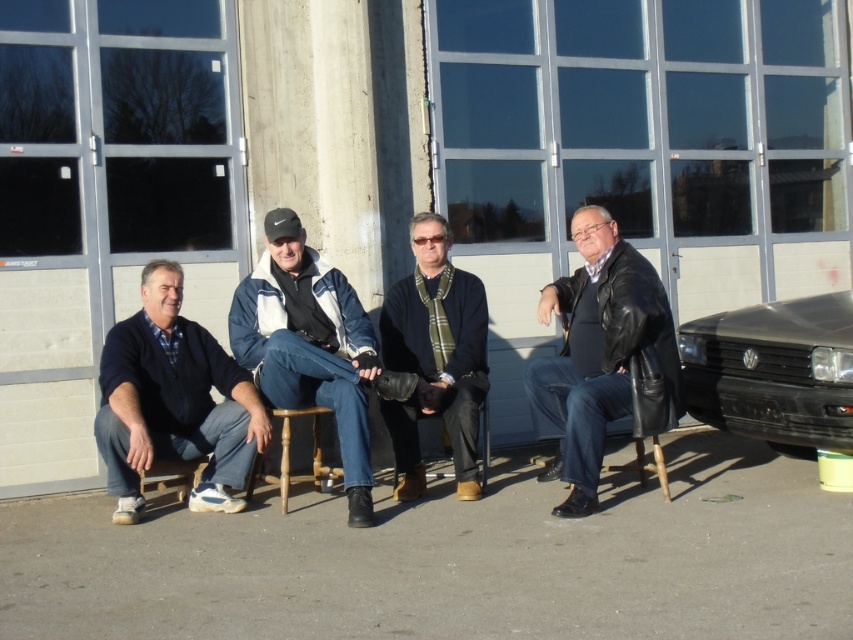
You are a photographer trying to capture a group photo of the men in front of the building. You want to ensure that both the white fleece jacket at center and the dark blue sweater at center are visible in the frame. Based on their positions, which one should you focus on first to ensure they are both in the shot?

Since the white fleece jacket at center is to the left of the dark blue sweater at center, you should focus on the white fleece jacket at center first to ensure both are in the frame as you adjust the camera angle.

You are taking a photo of the four men in front of the building. You want to focus on the point at point (582, 381) and the point at point (792, 321). Which point should you focus on first to ensure both are in focus?

You should focus on point (582, 381) first because it is closer to the camera than point (792, 321). This ensures the closer point is in focus, and the farther point will also be in focus due to depth of field.